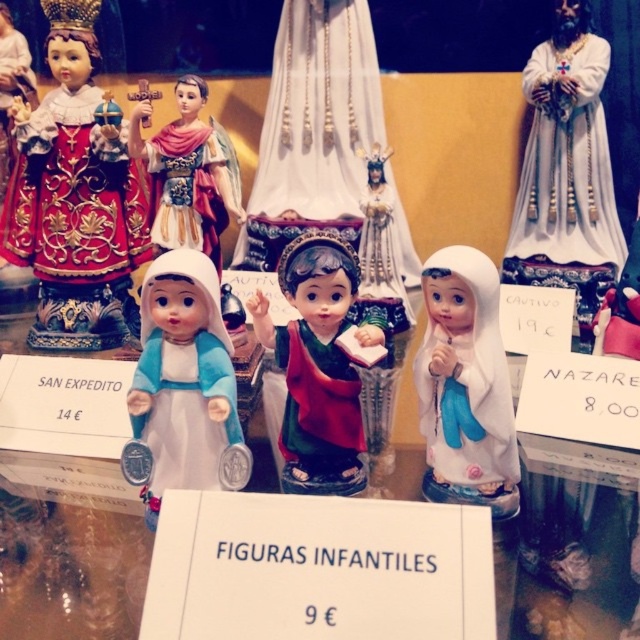
Does point (570, 108) come behind point (192, 196)?

That is True.

Does white glossy statue at upper right appear under matte porcelain doll at center?

No, white glossy statue at upper right is not below matte porcelain doll at center.

You are a GUI agent. You are given a task and a screenshot of the screen. Output one action in this format:
    pyautogui.click(x=<x>, y=<y>)
    Task: Click on the white glossy statue at upper right
    Image resolution: width=640 pixels, height=640 pixels.
    Given the screenshot: What is the action you would take?
    pyautogui.click(x=566, y=172)

Is point (600, 276) behind point (500, 384)?

That is True.

Who is lower down, white glossy statue at upper right or white glossy figurine at center?

Positioned lower is white glossy figurine at center.

Locate an element on the screen. The height and width of the screenshot is (640, 640). white glossy statue at upper right is located at coordinates (566, 172).

Between point (28, 148) and point (214, 209), which one is positioned in front?

Point (214, 209) is more forward.

Which is behind, point (136, 332) or point (177, 122)?

Positioned behind is point (136, 332).

I want to click on matte gold statue at upper left, so click(76, 198).